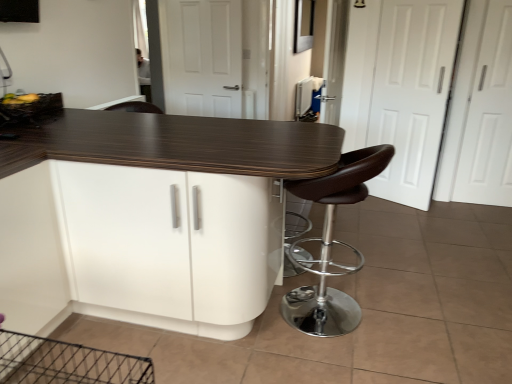
Question: Is wooden textured basket at upper left taller or shorter than brown leather stool at right?

Choices:
 (A) short
 (B) tall

Answer: (A)

Question: Considering the positions of wooden textured basket at upper left and brown leather stool at right in the image, is wooden textured basket at upper left bigger or smaller than brown leather stool at right?

Choices:
 (A) small
 (B) big

Answer: (A)

Question: Which object is the farthest from the white matte door at center, marked as the 3th screen door in a right-to-left arrangement?

Choices:
 (A) white matte screen door at right, acting as the first screen door starting from the right
 (B) brown leather stool at right
 (C) white glossy cabinet at center
 (D) white matte door at right, placed as the second screen door when sorted from left to right
 (E) wooden textured basket at upper left

Answer: (C)

Question: Estimate the real-world distances between objects in this image. Which object is farther from the brown leather stool at right?

Choices:
 (A) white matte door at center, which is the first screen door from left to right
 (B) white matte door at right, placed as the second screen door when sorted from left to right
 (C) white matte screen door at right, acting as the first screen door starting from the right
 (D) white glossy cabinet at center
 (E) wooden textured basket at upper left

Answer: (A)